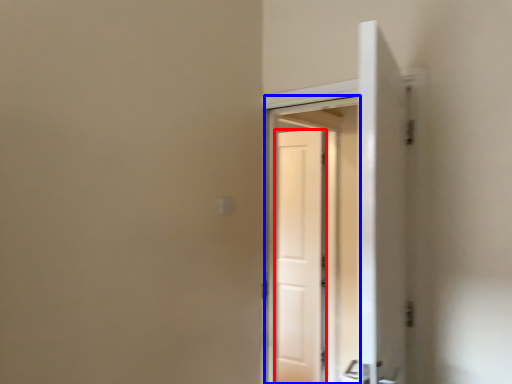
Question: Which of the following is the farthest to the observer, door (highlighted by a red box) or screen door (highlighted by a blue box)?

Choices:
 (A) door
 (B) screen door

Answer: (A)